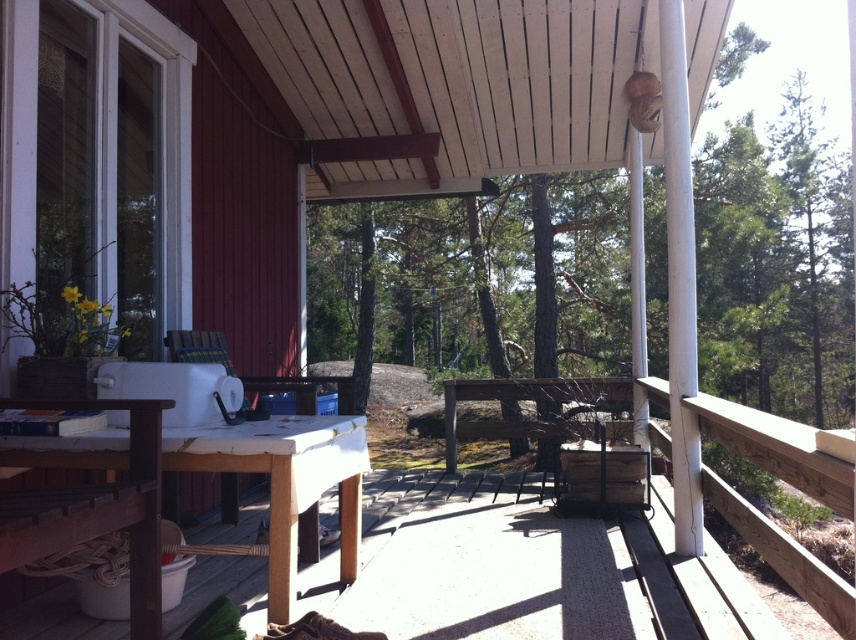
Question: Which point is farther to the camera?

Choices:
 (A) wooden table at center
 (B) white matte table at lower left

Answer: (B)

Question: Can you confirm if wooden table at center is positioned below white matte table at lower left?

Choices:
 (A) yes
 (B) no

Answer: (B)

Question: Does wooden table at center appear under white matte table at lower left?

Choices:
 (A) no
 (B) yes

Answer: (A)

Question: Can you confirm if wooden table at center is positioned above white matte table at lower left?

Choices:
 (A) yes
 (B) no

Answer: (A)

Question: Which of the following is the closest to the observer?

Choices:
 (A) (x=52, y=522)
 (B) (x=165, y=445)

Answer: (A)